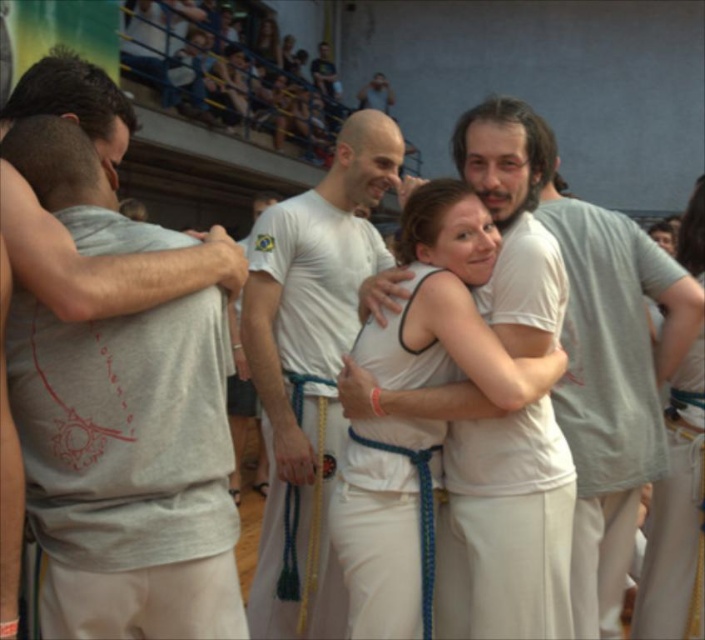
Question: Estimate the real-world distances between objects in this image. Which object is closer to the gray matte t-shirt at left?

Choices:
 (A) white cotton robe at center
 (B) white cotton shirt at center
 (C) white cotton tank top at center
 (D) gray cotton t-shirt at right

Answer: (A)

Question: Can you confirm if white fabric at center is bigger than gray cotton t-shirt at right?

Choices:
 (A) yes
 (B) no

Answer: (B)

Question: Which of the following is the closest to the observer?

Choices:
 (A) gray matte t-shirt at left
 (B) white cotton tank top at center
 (C) white cotton shirt at center

Answer: (A)

Question: Which point is farther to the camera?

Choices:
 (A) (398, 496)
 (B) (704, 259)
 (C) (618, 294)
 (D) (307, 518)

Answer: (D)

Question: Can you confirm if gray cotton t-shirt at right is positioned below gray matte t-shirt at left?

Choices:
 (A) yes
 (B) no

Answer: (A)

Question: Can you confirm if white cotton shirt at center is wider than white cotton tank top at center?

Choices:
 (A) no
 (B) yes

Answer: (B)